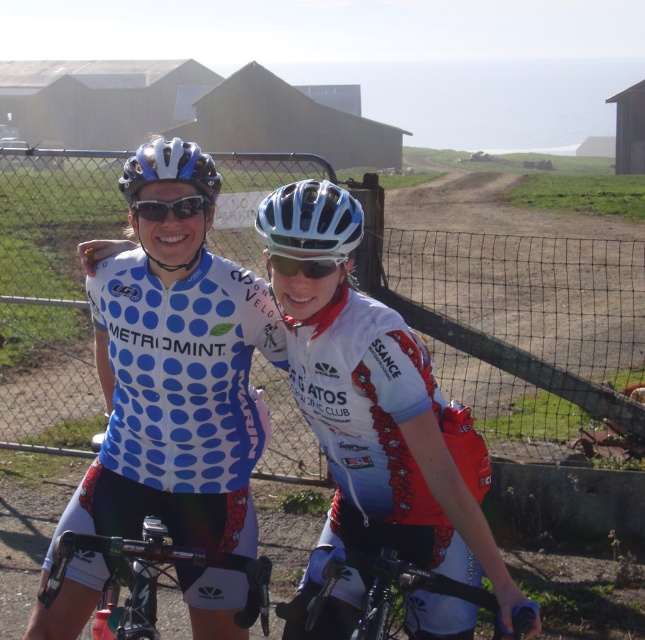
You are a photographer trying to capture a clear shot of both the white jersey at center and the shiny black bicycle at center. Based on their sizes in the image, which object should you focus on first to ensure both are in frame?

The white jersey at center has a greater height compared to the shiny black bicycle at center, so you should focus on the white jersey at center first to ensure both fit within the frame.

You are a photographer trying to capture the white glossy bicycle helmet at center. The camera you are using has a focal point set at coordinate point (310,220). Is this focal point correctly positioned to focus on the white glossy bicycle helmet at center?

Yes, the focal point at coordinate point (310,220) is correctly positioned because the point corresponds to the white glossy bicycle helmet at center.

You are a photographer trying to capture a clear photo of both the white jersey at center and the shiny black bicycle at center. Since the camera can only focus on one object at a time, which object should you focus on to ensure it appears larger in the final photo?

The white jersey at center is bigger than the shiny black bicycle at center, so focusing on the white jersey at center will ensure it appears larger in the photo.